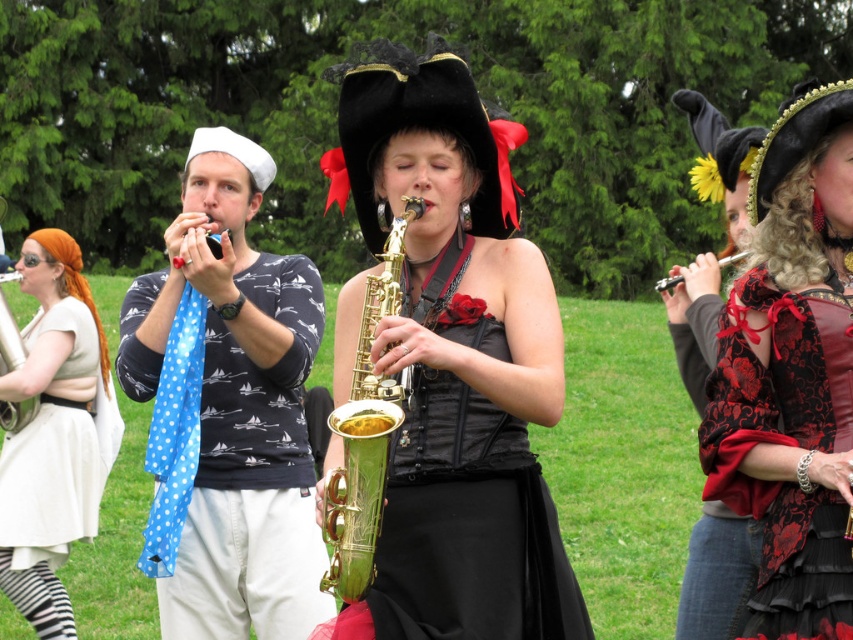
You are a photographer standing 3 meters away from the blue dotted scarf at left and the matte green saxophone at center. You want to take a photo of both objects in the same frame. Can you position yourself so that both objects are within the camera frame without moving the camera? Explain your reasoning.

The blue dotted scarf at left is 2.18 meters away from the matte green saxophone at center. Since you are 3 meters away from both objects, the distance between them is less than your distance from them. This means the angle between the two objects from your position is small enough to fit within the camera frame without moving the camera.

Based on the photo, you are organizing a small stage performance and need to arrange two items from the scene. The velvet red vest at center and the gold polished saxophone at center must be placed side by side on a narrow shelf. Considering their sizes, which item should be placed first to ensure both fit without overlapping?

The velvet red vest at center should be placed first since it is wider than the gold polished saxophone at center, allowing enough space for both items on the narrow shelf.